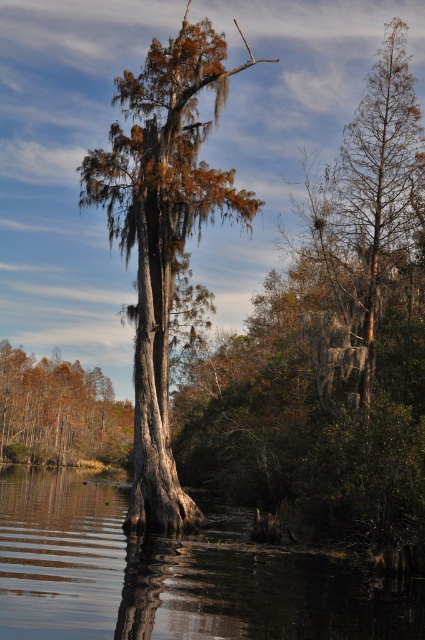
You are standing on a wooden platform observing the swamp scene. You notice the transparent water at center and the smooth gray bark cypress at center. Which object is positioned to the left of the other?

The transparent water at center is to the left of the smooth gray bark cypress at center according to the description.

You are a drone operator trying to capture the reflection of the tree in the transparent water at center. Based on the coordinates provided, which direction should you position the drone relative to the tree to ensure it captures the reflection?

The transparent water at center is located at point [173,573], so you should position the drone at that coordinate to capture the reflection of the tree in the transparent water at center.